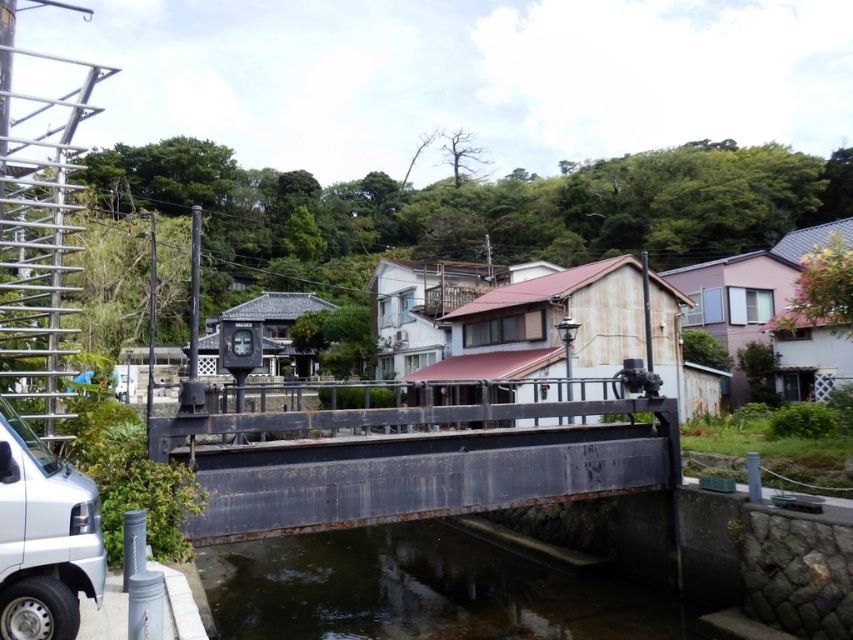
Question: Is the position of rusty metal bridge at center more distant than that of silver metallic van at lower left?

Choices:
 (A) yes
 (B) no

Answer: (A)

Question: Estimate the real-world distances between objects in this image. Which object is closer to the clear water at bridge center?

Choices:
 (A) silver metallic van at lower left
 (B) rusty metal bridge at center

Answer: (B)

Question: Does rusty metal bridge at center lie in front of clear water at bridge center?

Choices:
 (A) no
 (B) yes

Answer: (B)

Question: Which object is farther from the camera taking this photo?

Choices:
 (A) clear water at bridge center
 (B) rusty metal bridge at center
 (C) silver metallic van at lower left

Answer: (A)

Question: Considering the real-world distances, which object is closest to the rusty metal bridge at center?

Choices:
 (A) clear water at bridge center
 (B) silver metallic van at lower left

Answer: (A)

Question: Is rusty metal bridge at center to the right of silver metallic van at lower left from the viewer's perspective?

Choices:
 (A) yes
 (B) no

Answer: (A)